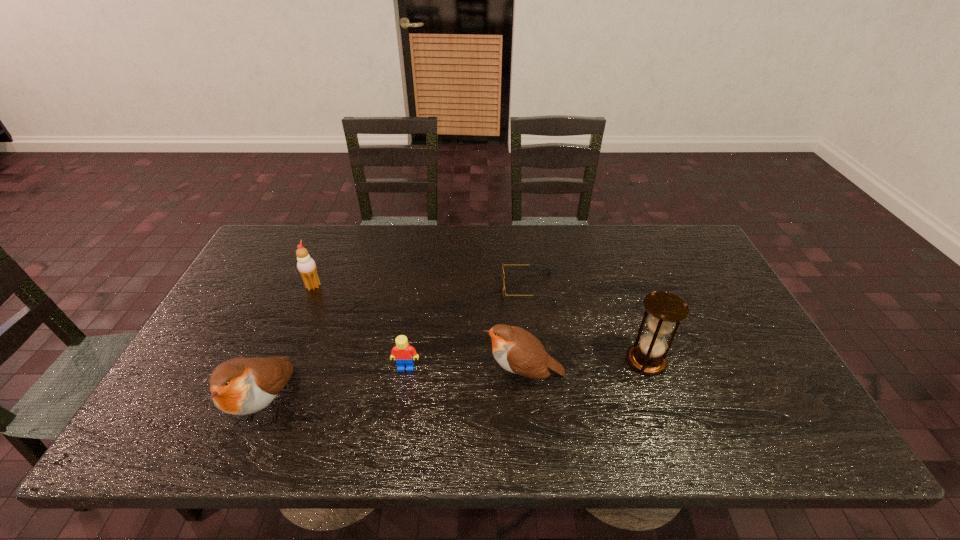
Where is `free location located at the front with a straw on the icecream`? free location located at the front with a straw on the icecream is located at coordinates (392, 286).

Locate an element on the screen. The image size is (960, 540). vacant space located 0.380m on the front-facing side of the sunglasses is located at coordinates (376, 286).

Where is `vacant space located 0.090m on the front-facing side of the sunglasses`? The width and height of the screenshot is (960, 540). vacant space located 0.090m on the front-facing side of the sunglasses is located at coordinates (472, 286).

Locate an element on the screen. The image size is (960, 540). vacant space located 0.240m on the front-facing side of the sunglasses is located at coordinates (422, 286).

In order to click on vacant space located on the left of the rightmost object in this screenshot , I will do `click(519, 361)`.

Find the location of `free space at the far edge`. free space at the far edge is located at coordinates (460, 261).

In the image, there is a desktop. In order to click on vacant space at the near edge in this screenshot , I will do `click(535, 392)`.

The width and height of the screenshot is (960, 540). I want to click on vacant space at the left edge of the desktop, so click(x=203, y=357).

Locate an element on the screen. vacant space at the far left corner of the desktop is located at coordinates (275, 255).

The image size is (960, 540). I want to click on vacant space at the near left corner, so click(x=173, y=387).